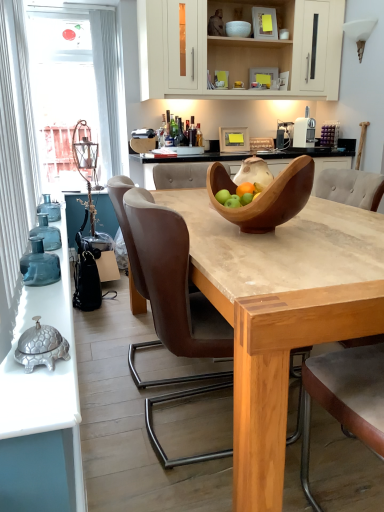
Where is `vacant space to the left of brown leather chair at center`? The height and width of the screenshot is (512, 384). vacant space to the left of brown leather chair at center is located at coordinates (113, 416).